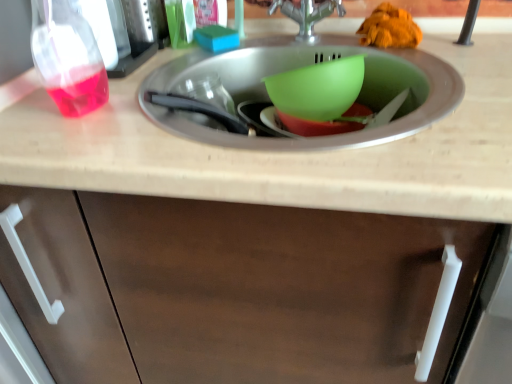
Where is `vacant area that is in front of transparent plastic bottle at left`? Image resolution: width=512 pixels, height=384 pixels. vacant area that is in front of transparent plastic bottle at left is located at coordinates (86, 144).